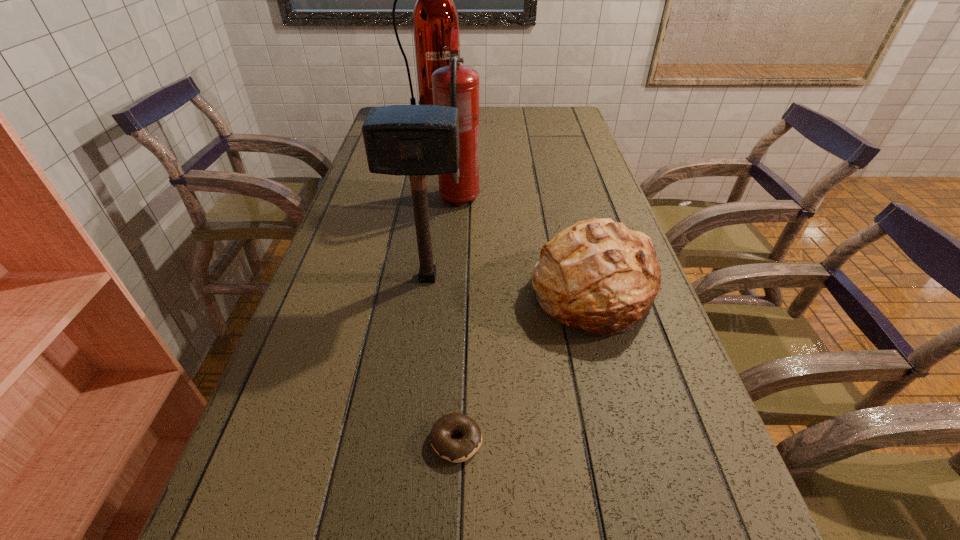
Where is `the tallest object`? the tallest object is located at coordinates (434, 15).

The height and width of the screenshot is (540, 960). Identify the location of the farthest object. [x=434, y=15].

This screenshot has width=960, height=540. I want to click on the shorter fire extinguisher, so click(x=455, y=85).

Identify the location of the second farthest object. Image resolution: width=960 pixels, height=540 pixels. (455, 85).

You are a GUI agent. You are given a task and a screenshot of the screen. Output one action in this format:
    pyautogui.click(x=<x>, y=<y>)
    Task: Click on the mallet
    Image resolution: width=960 pixels, height=540 pixels.
    Given the screenshot: What is the action you would take?
    pyautogui.click(x=417, y=140)

This screenshot has width=960, height=540. Find the location of `the rightmost object`. the rightmost object is located at coordinates (598, 276).

Find the location of a particular element. the second shortest object is located at coordinates (598, 276).

You are a GUI agent. You are given a task and a screenshot of the screen. Output one action in this format:
    pyautogui.click(x=<x>, y=<y>)
    Task: Click on the shortest object
    
    Given the screenshot: What is the action you would take?
    [455, 450]

Identify the location of doughnut. (455, 450).

I want to click on vacant area situated 0.240m on the front-facing side of the taller fire extinguisher, so click(x=425, y=155).